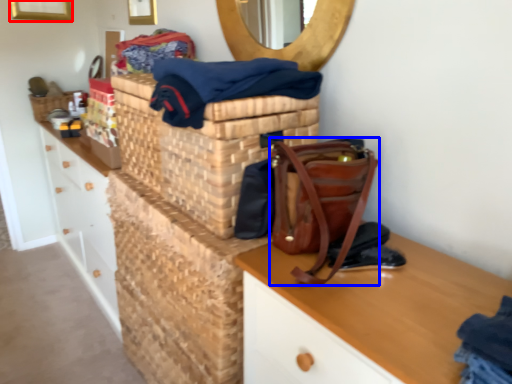
Question: Which object appears farthest to the camera in this image, picture frame (highlighted by a red box) or handbag (highlighted by a blue box)?

Choices:
 (A) picture frame
 (B) handbag

Answer: (A)